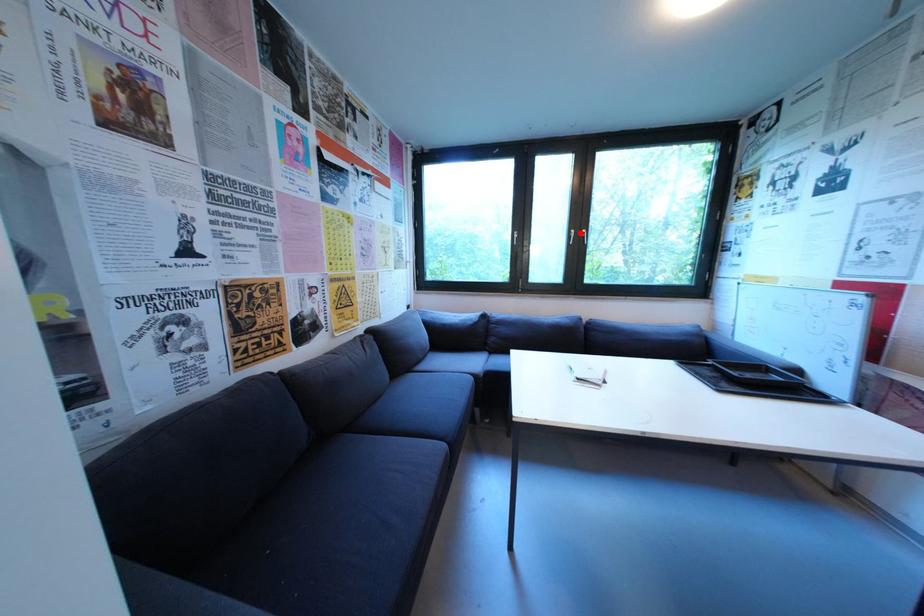
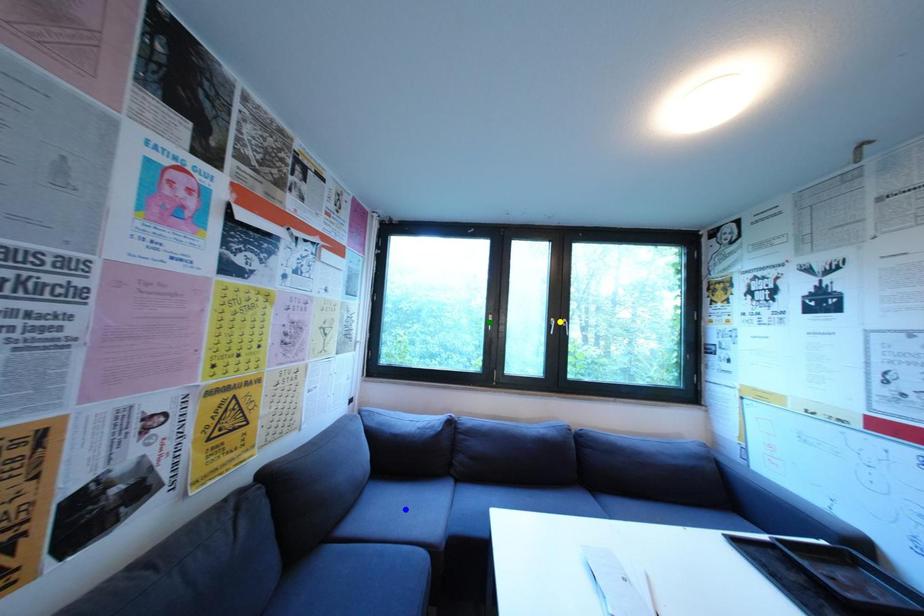
Question: I am providing you with two images of the same scene from different viewpoints. A red point is marked on the first image. You are given multiple points on the second image. Which point in image 2 is actually the same real-world point as the red point in image 1?

Choices:
 (A) blue point
 (B) green point
 (C) yellow point

Answer: (C)